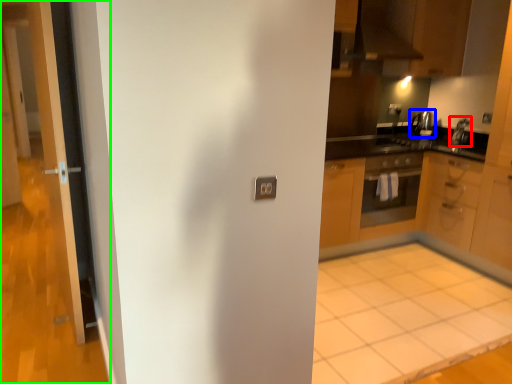
Question: Considering the real-world distances, which object is closest to appliance (highlighted by a red box)? appliance (highlighted by a blue box) or door (highlighted by a green box).

Choices:
 (A) appliance
 (B) door

Answer: (A)